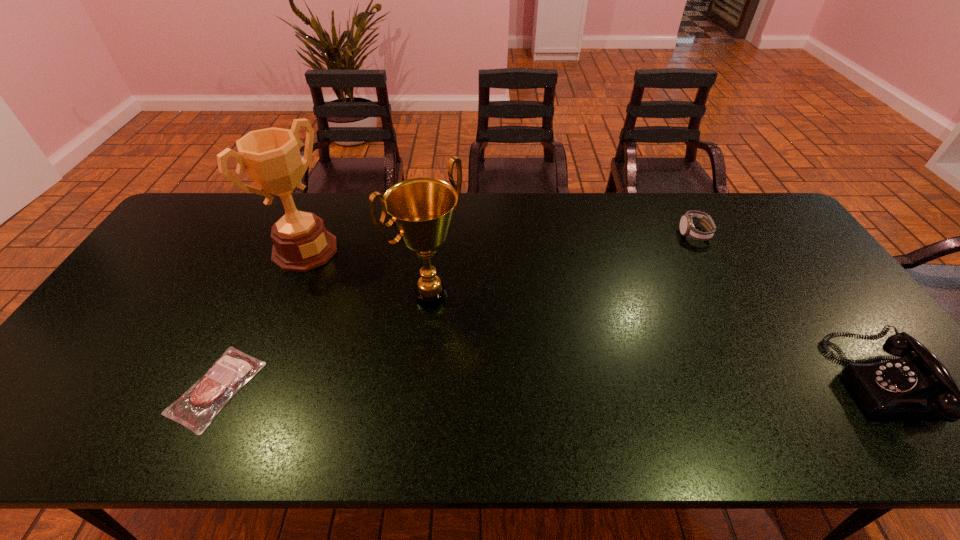
What are the coordinates of `vacant space on the desktop that is between the steak and the third tallest object and is positioned on the face of the second shortest object` in the screenshot? It's located at (577, 385).

The height and width of the screenshot is (540, 960). In order to click on vacant space on the desktop that is between the steak and the third tallest object and is positioned on the front-facing side of the left award in this screenshot , I will do `click(494, 386)`.

You are a GUI agent. You are given a task and a screenshot of the screen. Output one action in this format:
    pyautogui.click(x=<x>, y=<y>)
    Task: Click on the free space on the desktop that is between the shortest object and the telephone and is positioned on the front view with handles of the third object from left to right
    The height and width of the screenshot is (540, 960).
    Given the screenshot: What is the action you would take?
    pyautogui.click(x=534, y=386)